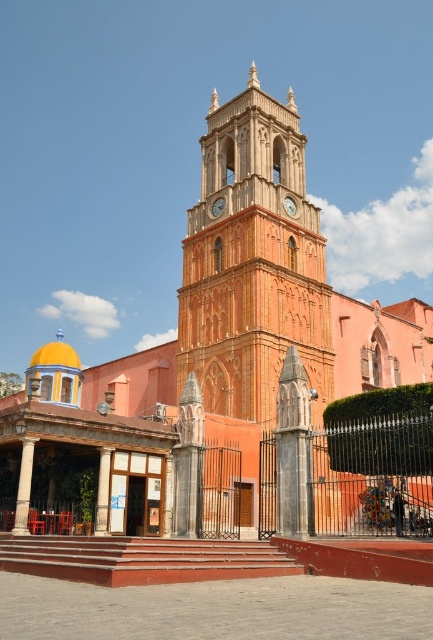
You are standing at the entrance of the church and want to take a photo of the terracotta brick tower at center. What are the coordinates where you should aim your camera?

You should aim your camera at the coordinates point (252, 262) where the terracotta brick tower at center is located.